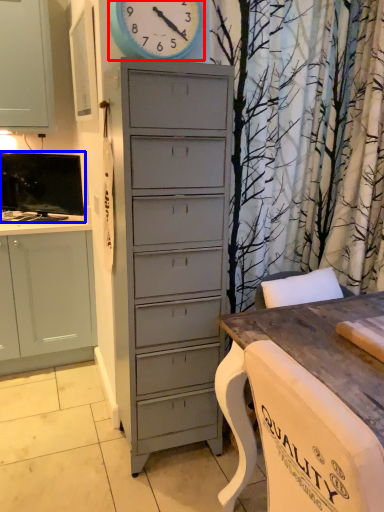
Question: Which of the following is the closest to the observer, clock (highlighted by a red box) or television (highlighted by a blue box)?

Choices:
 (A) clock
 (B) television

Answer: (A)